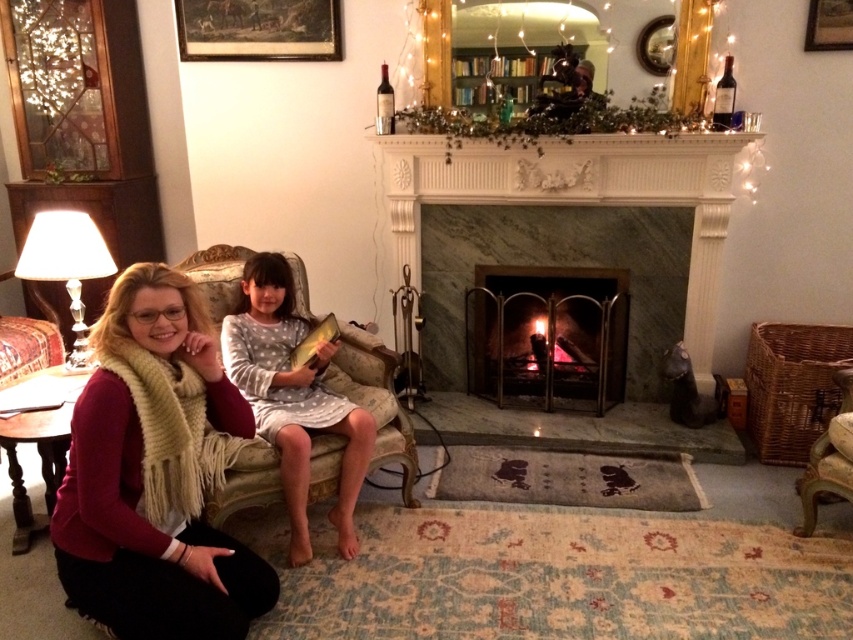
What object is located at the coordinates point (547, 337) in the scene?

A: The point (547, 337) is on the matte metal fireplace at center.

You are designing a living room layout and need to place a sofa that is 1.8 meters wide. You have two options for the fireplace, the marble fireplace at center and the matte metal fireplace at center. Which fireplace should you choose to ensure the sofa can fit alongside it without overcrowding the space?

The marble fireplace at center has a greater width than the matte metal fireplace at center. Therefore, selecting the matte metal fireplace at center would leave more space for the 1.8 meter wide sofa, preventing overcrowding in the living room.

From the picture: You are planning to hang a new picture that is the same size as the wooden framed painting at upper left on the wall next to the matte metal fireplace at center. Based on the scene description, will the new picture fit in height without needing to adjust its position?

The matte metal fireplace at center is taller than the wooden framed painting at upper left, so the new picture, being the same size as the wooden framed painting at upper left, will fit in height next to the matte metal fireplace at center without needing adjustment.